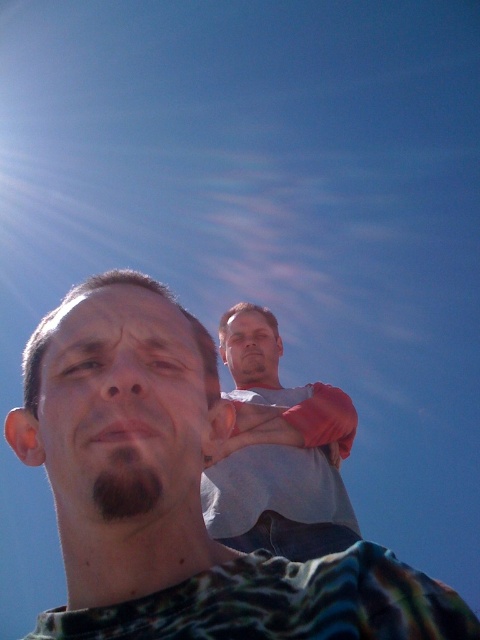
You are trying to take a photo of both the matte skin head at center and the smooth skin head at upper center. Which one is positioned higher in the frame?

The smooth skin head at upper center is positioned higher because it is located above the matte skin head at center.

You are a photographer trying to adjust the lighting for a portrait. You notice the gray cotton shirt at center and the smooth skin head at upper center. Which object is positioned lower in the frame?

The gray cotton shirt at center is located below smooth skin head at upper center, so the gray cotton shirt at center is positioned lower in the frame.